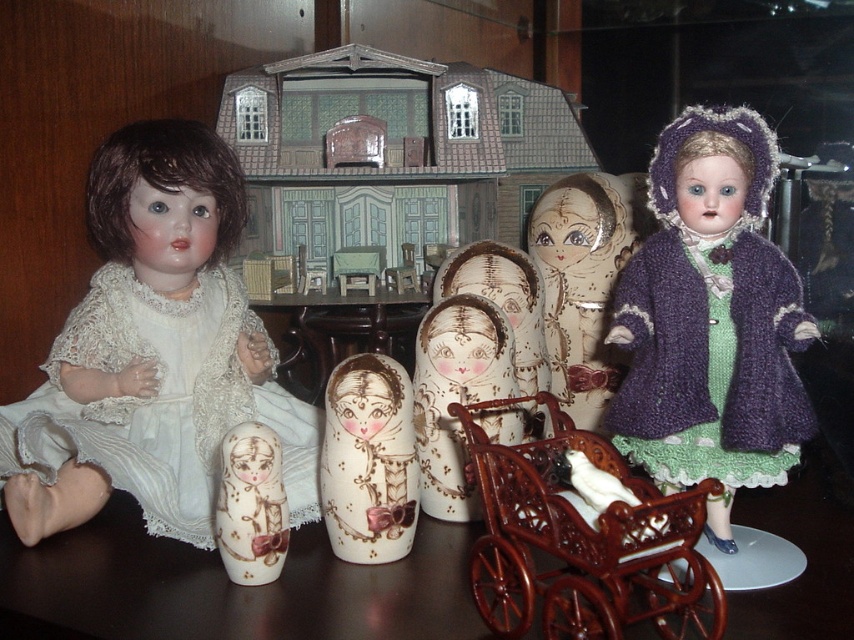
Question: Considering the relative positions of wooden doll at center and wooden table at center in the image provided, where is wooden doll at center located with respect to wooden table at center?

Choices:
 (A) below
 (B) above

Answer: (A)

Question: Which point appears closest to the camera in this image?

Choices:
 (A) (147, 424)
 (B) (430, 326)
 (C) (785, 600)
 (D) (568, 292)

Answer: (C)

Question: Which point appears farthest from the camera in this image?

Choices:
 (A) (585, 243)
 (B) (410, 340)

Answer: (B)

Question: Is knitted purple coat at upper right to the left of matte cream doll at center from the viewer's perspective?

Choices:
 (A) yes
 (B) no

Answer: (B)

Question: From the image, what is the correct spatial relationship of matte brown doll at center in relation to matte cream doll at center?

Choices:
 (A) above
 (B) below

Answer: (A)

Question: Considering the real-world distances, which object is closest to the wooden table at center?

Choices:
 (A) matte cream doll at center
 (B) painted wood nesting dolls at center

Answer: (B)